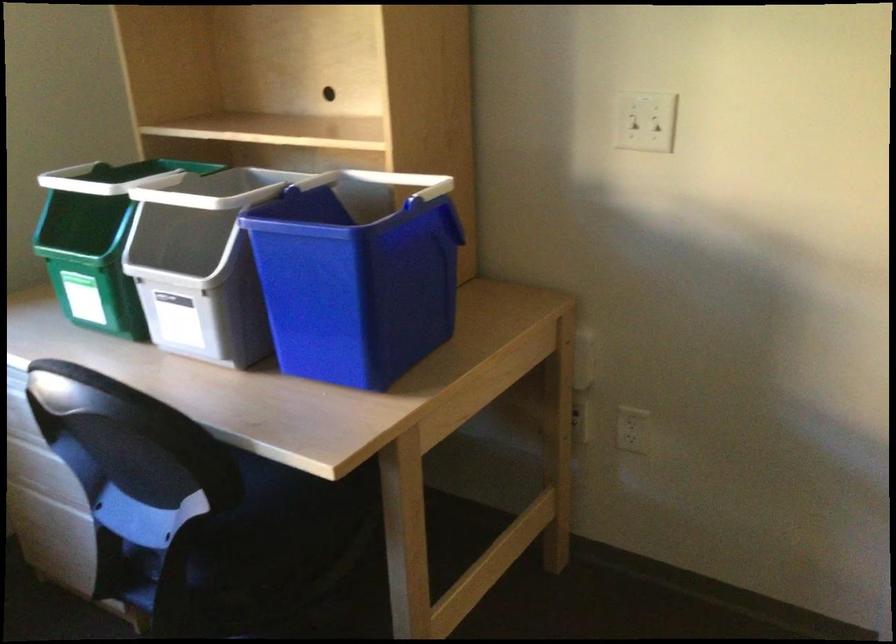
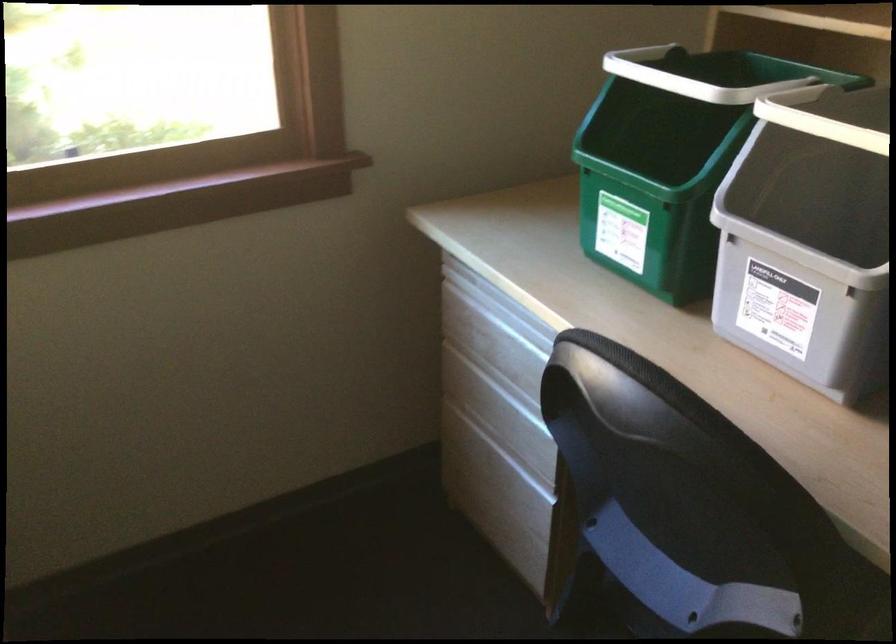
Question: The camera is either moving clockwise (left) or counter-clockwise (right) around the object. The first image is from the beginning of the video and the second image is from the end. Is the camera moving left or right when shooting the video?

Choices:
 (A) Left
 (B) Right

Answer: (B)